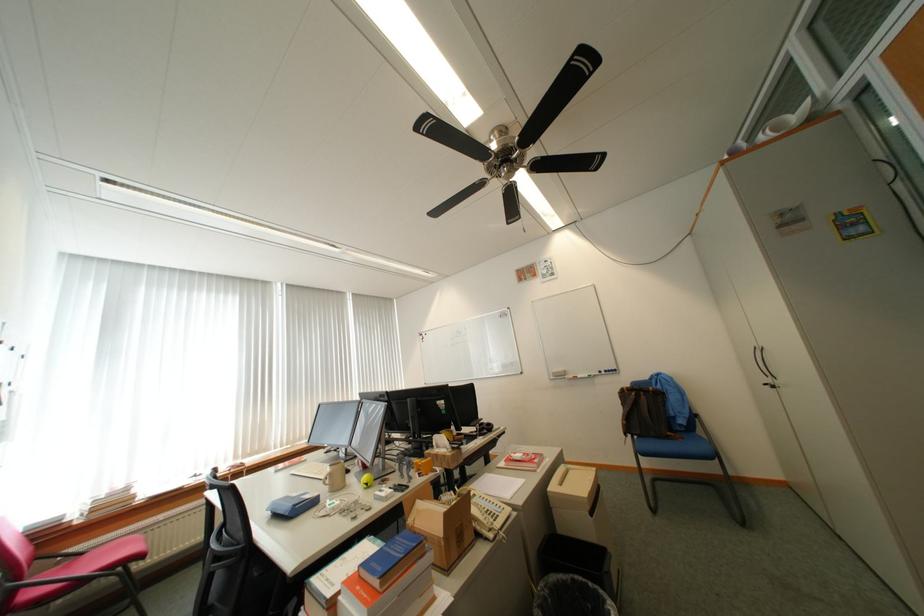
Find the location of a particular element. yellow tennis ball is located at coordinates (367, 480).